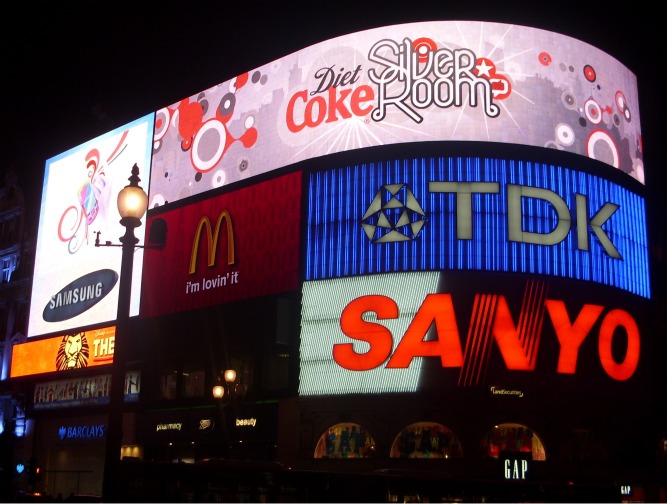
The width and height of the screenshot is (667, 504). In order to click on label: silver room in this screenshot , I will do `click(370, 53)`.